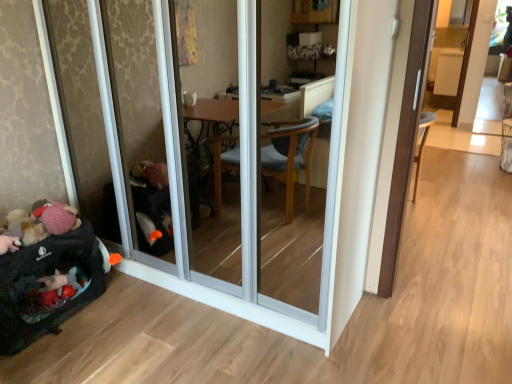
Where is `vacant region to the right of dark gray fabric baby carriage at lower left`? The image size is (512, 384). vacant region to the right of dark gray fabric baby carriage at lower left is located at coordinates (119, 321).